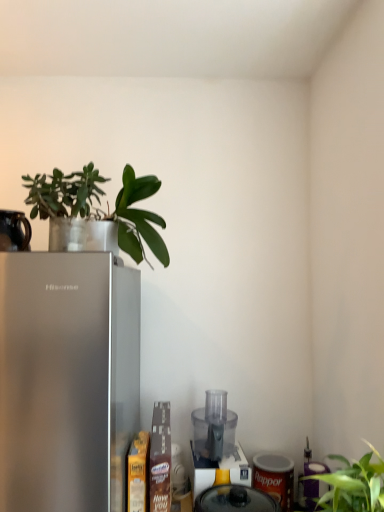
Where is `transparent plastic blender at center`? transparent plastic blender at center is located at coordinates (x=216, y=445).

Image resolution: width=384 pixels, height=512 pixels. Identify the location of satin silver refrigerator at left. point(67,380).

Describe the element at coordinates (67, 380) in the screenshot. I see `satin silver refrigerator at left` at that location.

Describe the element at coordinates (214, 426) in the screenshot. The width and height of the screenshot is (384, 512). I see `transparent plastic food processor at lower center, the 1th appliance viewed from the back` at that location.

I want to click on transparent plastic food processor at lower center, arranged as the second appliance when viewed from the left, so click(x=214, y=426).

Image resolution: width=384 pixels, height=512 pixels. What do you see at coordinates (64, 193) in the screenshot? I see `green matte plant at upper left, the 2th plant in the right-to-left sequence` at bounding box center [64, 193].

Measure the distance between green matte plant at upper left, the first plant when ordered from left to right, and camera.

The depth of green matte plant at upper left, the first plant when ordered from left to right, is 1.13 meters.

At what (x,y) coordinates should I click in order to perform the action: click on black ceramic mug at upper left, arranged as the third appliance when viewed from the back. Please return your answer as a coordinate pair (x, y). Looking at the image, I should click on (14, 231).

Where is `green matte leafy plant at upper left, the 2th plant viewed from the left`? Image resolution: width=384 pixels, height=512 pixels. green matte leafy plant at upper left, the 2th plant viewed from the left is located at coordinates (137, 218).

Locate an element on the screen. The image size is (384, 512). transparent plastic blender at center is located at coordinates coord(216,445).

The image size is (384, 512). In order to click on appliance that is the 3rd object above the transparent plastic blender at center (from a real-world perspective) in this screenshot , I will do `click(14, 231)`.

From the image's perspective, between black ceramic mug at upper left, positioned as the third appliance in right-to-left order, and transparent plastic blender at center, who is located below?

transparent plastic blender at center appears lower in the image.

Relative to transparent plastic blender at center, is black ceramic mug at upper left, which ranks as the first appliance in left-to-right order, in front or behind?

black ceramic mug at upper left, which ranks as the first appliance in left-to-right order, is positioned closer to the viewer than transparent plastic blender at center.

Is transparent plastic blender at center inside black ceramic mug at upper left, acting as the third appliance starting from the bottom?

No, transparent plastic blender at center is not inside black ceramic mug at upper left, acting as the third appliance starting from the bottom.

In order to click on appliance that is the 1st object located behind the green matte plant at upper left, the 2th plant in the right-to-left sequence in this screenshot , I will do `click(14, 231)`.

Is black ceramic mug at upper left, marked as the first appliance in a top-to-bottom arrangement, taller than green matte plant at upper left, the first plant when ordered from left to right?

In fact, black ceramic mug at upper left, marked as the first appliance in a top-to-bottom arrangement, may be shorter than green matte plant at upper left, the first plant when ordered from left to right.

Which point is more forward, (12, 223) or (48, 193)?

The point (48, 193) is closer.

Is point (68, 204) farther from camera compared to point (233, 433)?

No, (68, 204) is in front of (233, 433).

Could you tell me if green matte plant at upper left, the 2th plant in the right-to-left sequence, is facing transparent plastic food processor at lower center, positioned as the second appliance in top-to-bottom order?

No, green matte plant at upper left, the 2th plant in the right-to-left sequence, does not turn towards transparent plastic food processor at lower center, positioned as the second appliance in top-to-bottom order.

Considering the positions of objects green matte plant at upper left, the 2th plant in the right-to-left sequence, and transparent plastic food processor at lower center, the 2th appliance ordered from the bottom, in the image provided, who is in front, green matte plant at upper left, the 2th plant in the right-to-left sequence, or transparent plastic food processor at lower center, the 2th appliance ordered from the bottom,?

Positioned in front is green matte plant at upper left, the 2th plant in the right-to-left sequence.

Relative to black ceramic mug at upper left, placed as the first appliance when sorted from front to back, is transparent plastic blender at center in front or behind?

transparent plastic blender at center is behind black ceramic mug at upper left, placed as the first appliance when sorted from front to back.

Considering the sizes of objects transparent plastic blender at center and black ceramic mug at upper left, which ranks as the first appliance in left-to-right order, in the image provided, who is thinner, transparent plastic blender at center or black ceramic mug at upper left, which ranks as the first appliance in left-to-right order,?

black ceramic mug at upper left, which ranks as the first appliance in left-to-right order.

From a real-world perspective, which is physically above, transparent plastic blender at center or black ceramic mug at upper left, positioned as the third appliance in right-to-left order?

black ceramic mug at upper left, positioned as the third appliance in right-to-left order, is physically above.

Looking at this image, considering the relative sizes of green matte plant at upper left, the first plant when ordered from left to right, and translucent plastic food processor at center, the 3th appliance when ordered from left to right, in the image provided, is green matte plant at upper left, the first plant when ordered from left to right, smaller than translucent plastic food processor at center, the 3th appliance when ordered from left to right,?

Incorrect, green matte plant at upper left, the first plant when ordered from left to right, is not smaller in size than translucent plastic food processor at center, the 3th appliance when ordered from left to right.

Considering the positions of point (51, 192) and point (212, 493), is point (51, 192) closer or farther from the camera than point (212, 493)?

Point (51, 192) is closer to the camera than point (212, 493).

From a real-world perspective, is green matte plant at upper left, the 2th plant in the right-to-left sequence, on top of translucent plastic food processor at center, the first appliance when ordered from right to left?

Yes, from a real-world perspective, green matte plant at upper left, the 2th plant in the right-to-left sequence, is above translucent plastic food processor at center, the first appliance when ordered from right to left.

Could you tell me if green matte plant at upper left, the 2th plant in the right-to-left sequence, is turned towards translucent plastic food processor at center, positioned as the second appliance in front-to-back order?

A: No, green matte plant at upper left, the 2th plant in the right-to-left sequence, is not aimed at translucent plastic food processor at center, positioned as the second appliance in front-to-back order.

Is transparent plastic blender at center bigger than transparent plastic food processor at lower center, arranged as the second appliance when viewed from the left?

Indeed, transparent plastic blender at center has a larger size compared to transparent plastic food processor at lower center, arranged as the second appliance when viewed from the left.

Relative to transparent plastic food processor at lower center, the 1th appliance viewed from the back, is transparent plastic blender at center in front or behind?

transparent plastic blender at center is in front of transparent plastic food processor at lower center, the 1th appliance viewed from the back.

Can you tell me how much transparent plastic blender at center and transparent plastic food processor at lower center, arranged as the second appliance when viewed from the left, differ in facing direction?

They differ by 2.15 degrees in their facing directions.

Would you say satin silver refrigerator at left is to the left or to the right of transparent plastic blender at center in the picture?

From the image, it's evident that satin silver refrigerator at left is to the left of transparent plastic blender at center.

Considering the positions of objects satin silver refrigerator at left and transparent plastic blender at center in the image provided, who is behind, satin silver refrigerator at left or transparent plastic blender at center?

transparent plastic blender at center is behind.

Based on their sizes in the image, would you say satin silver refrigerator at left is bigger or smaller than transparent plastic blender at center?

Clearly, satin silver refrigerator at left is larger in size than transparent plastic blender at center.

How distant is satin silver refrigerator at left from transparent plastic blender at center?

The distance of satin silver refrigerator at left from transparent plastic blender at center is 21.05 inches.

There is a transparent plastic blender at center. Identify the location of the 3rd appliance above it (from a real-world perspective). This screenshot has height=512, width=384. (14, 231).

Locate an element on the screen. Image resolution: width=384 pixels, height=512 pixels. the 2nd plant above when counting from the black ceramic mug at upper left, placed as the first appliance when sorted from front to back (from the image's perspective) is located at coordinates (64, 193).

When comparing their distances from transparent plastic blender at center, does translucent plastic food processor at center, positioned as the second appliance in front-to-back order, or green matte plant at upper left, the first plant when ordered from left to right, seem closer?

translucent plastic food processor at center, positioned as the second appliance in front-to-back order, lies closer to transparent plastic blender at center than the other object.

Estimate the real-world distances between objects in this image. Which object is further from transparent plastic blender at center, green matte leafy plant at upper left, which is the first plant in right-to-left order, or translucent plastic food processor at center, the 3th appliance when ordered from left to right?

Among the two, green matte leafy plant at upper left, which is the first plant in right-to-left order, is located further to transparent plastic blender at center.

Considering their positions, is green matte plant at upper left, the first plant when ordered from left to right, positioned further to satin silver refrigerator at left than transparent plastic blender at center?

The object further to satin silver refrigerator at left is transparent plastic blender at center.

From the image, which object appears to be farther from transparent plastic food processor at lower center, which ranks as the 3th appliance in front-to-back order, black ceramic mug at upper left, arranged as the third appliance when viewed from the back, or transparent plastic blender at center?

black ceramic mug at upper left, arranged as the third appliance when viewed from the back.

Which object lies nearer to the anchor point transparent plastic blender at center, satin silver refrigerator at left or translucent plastic food processor at center, which is the 1th appliance from bottom to top?

translucent plastic food processor at center, which is the 1th appliance from bottom to top.

In the scene shown: Based on their spatial positions, is translucent plastic food processor at center, the 2th appliance from the back, or black ceramic mug at upper left, positioned as the third appliance in right-to-left order, further from green matte plant at upper left, the first plant when ordered from left to right?

translucent plastic food processor at center, the 2th appliance from the back, is further to green matte plant at upper left, the first plant when ordered from left to right.

Estimate the real-world distances between objects in this image. Which object is closer to green matte leafy plant at upper left, which is the first plant in right-to-left order, green matte plant at upper left, the first plant when ordered from left to right, or satin silver refrigerator at left?

Among the two, green matte plant at upper left, the first plant when ordered from left to right, is located nearer to green matte leafy plant at upper left, which is the first plant in right-to-left order.

Estimate the real-world distances between objects in this image. Which object is further from transparent plastic blender at center, transparent plastic food processor at lower center, the 2th appliance ordered from the bottom, or satin silver refrigerator at left?

satin silver refrigerator at left.

Find the location of a particular element. The height and width of the screenshot is (512, 384). plant between green matte plant at upper left, the first plant when ordered from left to right, and transparent plastic blender at center, in the vertical direction is located at coordinates (137, 218).

The width and height of the screenshot is (384, 512). I want to click on blender between satin silver refrigerator at left and translucent plastic food processor at center, positioned as the 3th appliance in top-to-bottom order, in the horizontal direction, so click(x=216, y=445).

The height and width of the screenshot is (512, 384). What are the coordinates of `plant between black ceramic mug at upper left, arranged as the third appliance when viewed from the back, and green matte leafy plant at upper left, which is the first plant in right-to-left order, from left to right` in the screenshot? It's located at [x=64, y=193].

You are a GUI agent. You are given a task and a screenshot of the screen. Output one action in this format:
    pyautogui.click(x=<x>, y=<y>)
    Task: Click on the refrigerator between black ceramic mug at upper left, placed as the first appliance when sorted from front to back, and translucent plastic food processor at center, positioned as the 3th appliance in top-to-bottom order, in the up-down direction
    The width and height of the screenshot is (384, 512).
    Given the screenshot: What is the action you would take?
    pyautogui.click(x=67, y=380)